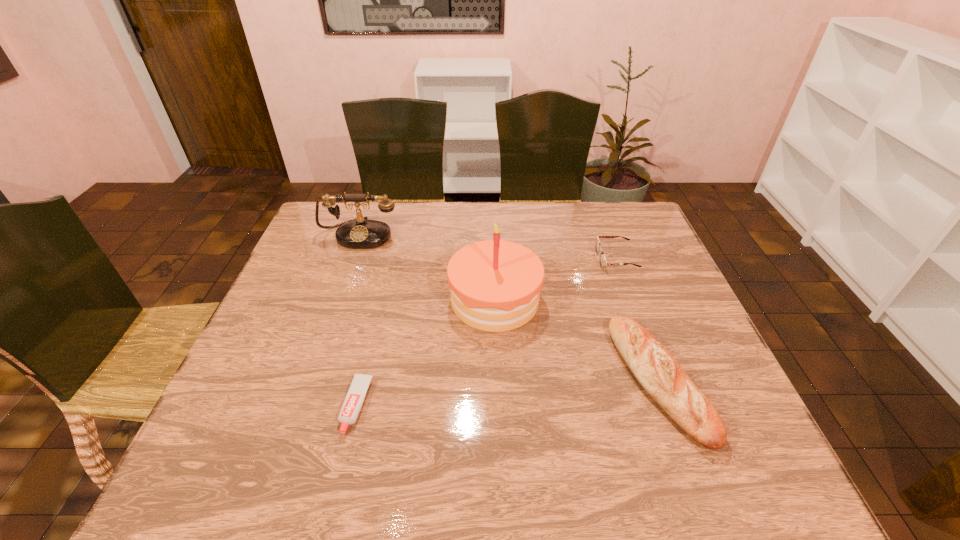
Locate an element on the screen. vacant space at the far edge of the desktop is located at coordinates (516, 219).

This screenshot has width=960, height=540. In order to click on blank area at the left edge in this screenshot , I will do `click(293, 296)`.

You are a GUI agent. You are given a task and a screenshot of the screen. Output one action in this format:
    pyautogui.click(x=<x>, y=<y>)
    Task: Click on the vacant space at the right edge of the desktop
    The image size is (960, 540).
    Given the screenshot: What is the action you would take?
    pyautogui.click(x=618, y=257)

Where is `vacant area at the far right corner`? vacant area at the far right corner is located at coordinates (622, 216).

In the image, there is a desktop. Find the location of `free space at the near right corner`. free space at the near right corner is located at coordinates (703, 467).

In order to click on free space between the telephone and the third object from left to right in this screenshot , I will do `click(427, 267)`.

Where is `free area in between the third object from right to left and the baguet`? Image resolution: width=960 pixels, height=540 pixels. free area in between the third object from right to left and the baguet is located at coordinates (577, 341).

Where is `free spot between the third object from left to right and the fourth tallest object`? Image resolution: width=960 pixels, height=540 pixels. free spot between the third object from left to right and the fourth tallest object is located at coordinates click(x=555, y=279).

Where is `free space between the fourth shortest object and the third object from right to left`? Image resolution: width=960 pixels, height=540 pixels. free space between the fourth shortest object and the third object from right to left is located at coordinates (427, 267).

Identify the location of free space that is in between the baguet and the birthday cake. (577, 341).